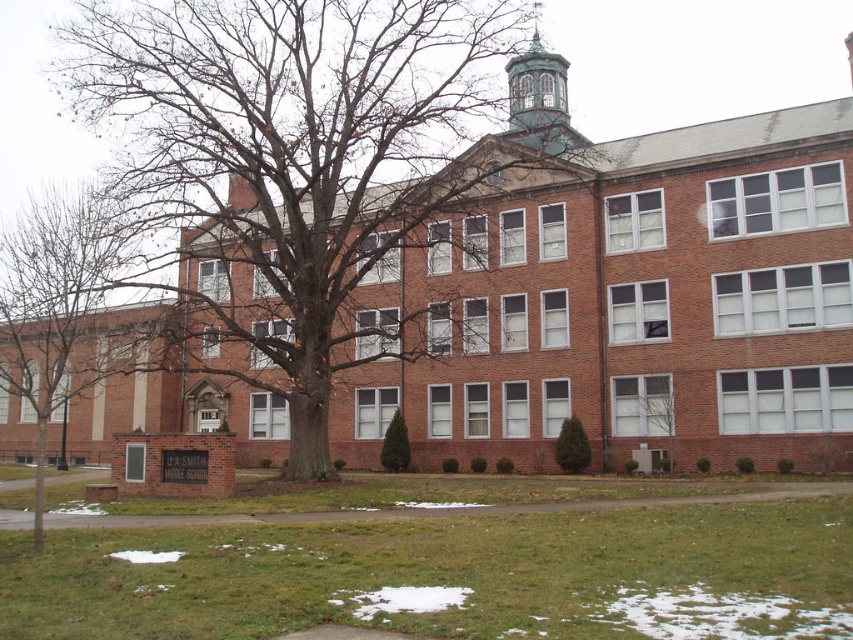
Question: Which point is closer to the camera taking this photo?

Choices:
 (A) (566, 140)
 (B) (564, 472)
 (C) (117, 212)

Answer: (B)

Question: Which point appears farthest from the camera in this image?

Choices:
 (A) (663, 394)
 (B) (566, 120)
 (C) (140, 307)

Answer: (B)

Question: Which object is positioned closest to the green copper bell tower at upper center?

Choices:
 (A) brown bark tree at center
 (B) green leafy tree at center
 (C) green textured shrub at center

Answer: (A)

Question: Does brown bark tree at center have a larger size compared to green copper bell tower at upper center?

Choices:
 (A) yes
 (B) no

Answer: (A)

Question: In this image, where is green textured shrub at center located relative to green textured evergreen at center?

Choices:
 (A) below
 (B) above

Answer: (B)

Question: Observing the image, what is the correct spatial positioning of brown bark tree at center in reference to green textured evergreen at center?

Choices:
 (A) above
 (B) below

Answer: (A)